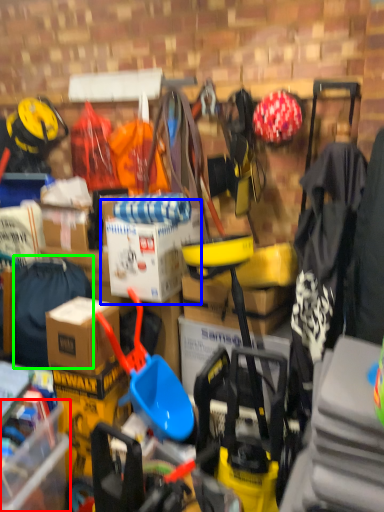
Question: Based on their relative distances, which object is farther from storage box (highlighted by a red box)? Choose from cardboard box (highlighted by a blue box) and clothing (highlighted by a green box).

Choices:
 (A) cardboard box
 (B) clothing

Answer: (A)